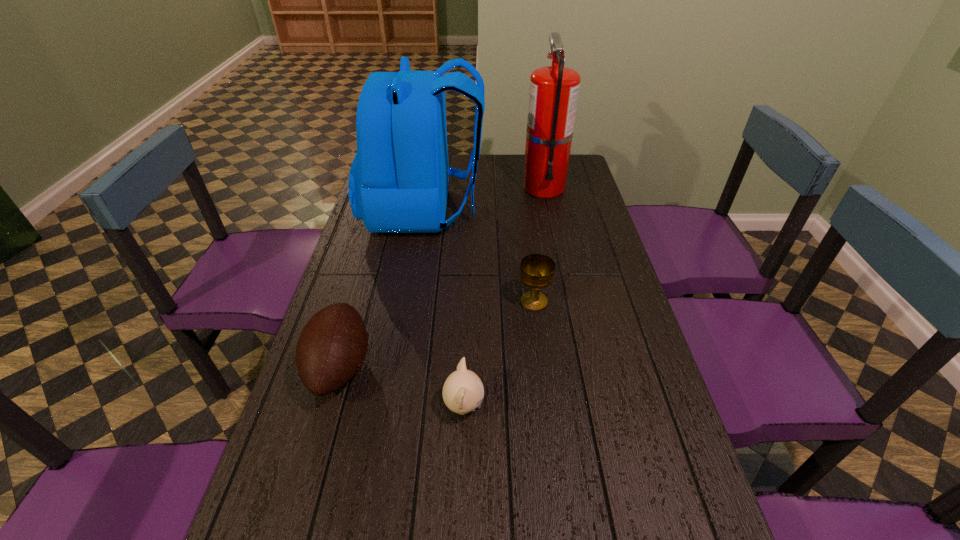
Where is `free spot between the chalice and the kitten`? free spot between the chalice and the kitten is located at coordinates (499, 354).

Where is `vacant region between the fire extinguisher and the chalice`? This screenshot has height=540, width=960. vacant region between the fire extinguisher and the chalice is located at coordinates (539, 244).

The width and height of the screenshot is (960, 540). What are the coordinates of `vacant space that is in between the kitten and the fire extinguisher` in the screenshot? It's located at (504, 297).

What are the coordinates of `blank region between the chalice and the kitten` in the screenshot? It's located at [x=499, y=354].

The height and width of the screenshot is (540, 960). I want to click on empty location between the chalice and the football, so click(x=437, y=334).

At what (x,y) coordinates should I click in order to perform the action: click on object that ranks as the closest to the kitten. Please return your answer as a coordinate pair (x, y). Image resolution: width=960 pixels, height=540 pixels. Looking at the image, I should click on (332, 347).

What are the coordinates of `object that is the second closest to the kitten` in the screenshot? It's located at (537, 271).

I want to click on free space that satisfies the following two spatial constraints: 1. at the nozzle of the fire extinguisher; 2. on the face of the kitten, so click(x=589, y=407).

This screenshot has width=960, height=540. I want to click on vacant position in the image that satisfies the following two spatial constraints: 1. at the nozzle of the fire extinguisher; 2. on the laces of the football, so click(581, 366).

I want to click on free space that satisfies the following two spatial constraints: 1. at the nozzle of the fire extinguisher; 2. on the face of the kitten, so click(x=589, y=407).